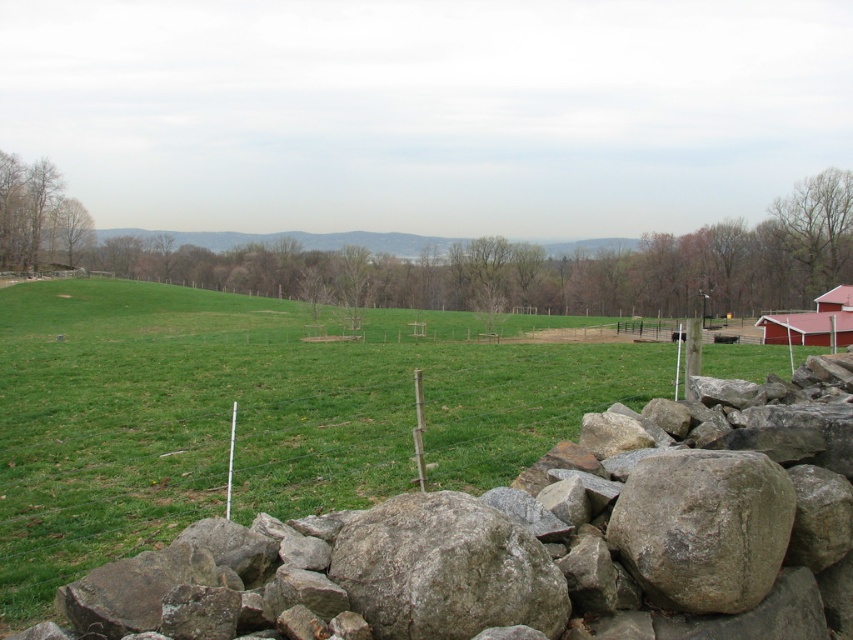
Question: Does green grassy field at center have a greater width compared to red wooden barn at right?

Choices:
 (A) yes
 (B) no

Answer: (A)

Question: Which point is closer to the camera taking this photo?

Choices:
 (A) (839, 328)
 (B) (287, 356)

Answer: (B)

Question: Is green grassy field at center closer to the viewer compared to red wooden barn at right?

Choices:
 (A) yes
 (B) no

Answer: (A)

Question: Can you confirm if green grassy field at center is positioned above red wooden barn at right?

Choices:
 (A) yes
 (B) no

Answer: (A)

Question: Which point appears closest to the camera in this image?

Choices:
 (A) (61, 388)
 (B) (820, 326)

Answer: (A)